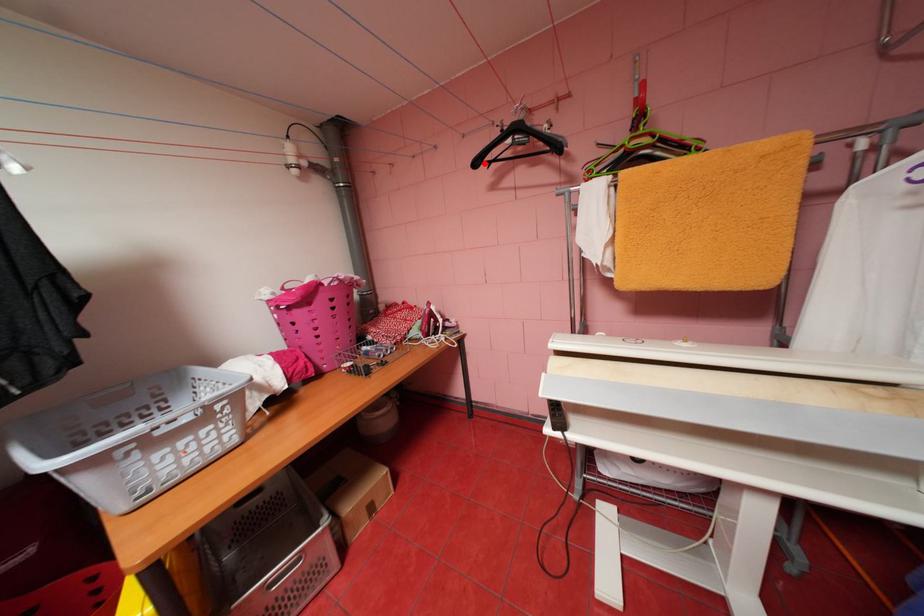
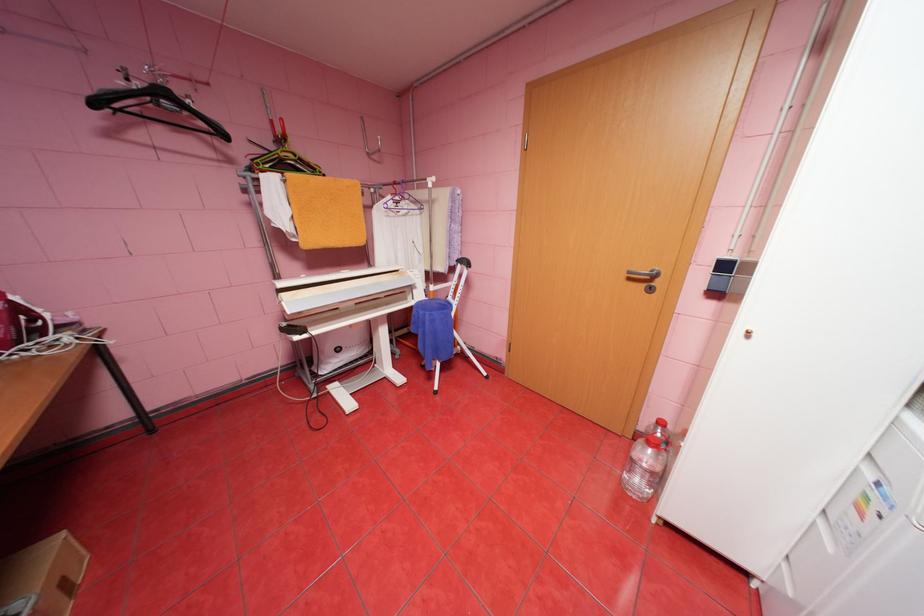
The point at the highlighted location is marked in the first image. Where is the corresponding point in the second image?

(103, 103)